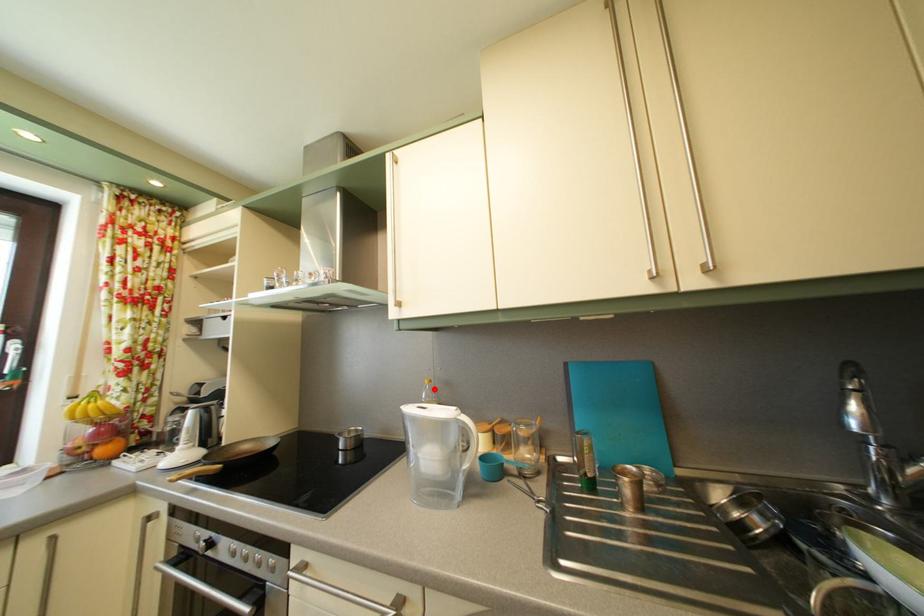
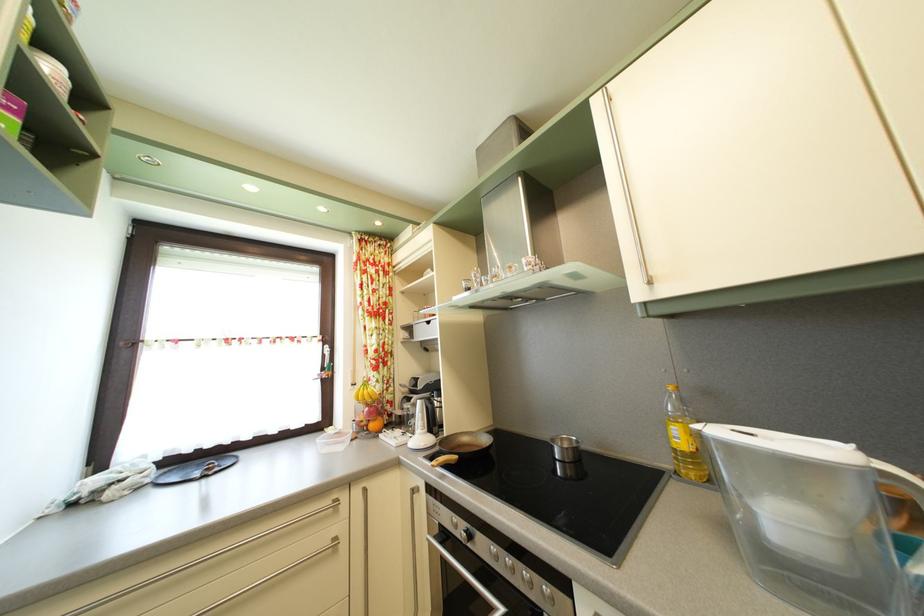
Where in the second image is the point corresponding to the highlighted location from the first image?

(678, 395)